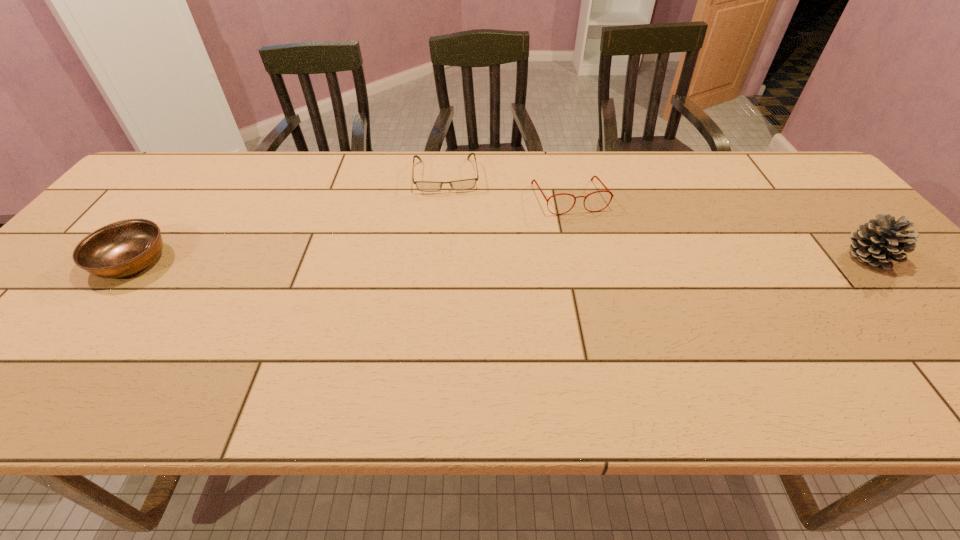
In the image, there is a desktop. Where is `free space at the left edge`? The image size is (960, 540). free space at the left edge is located at coordinates (60, 291).

In the image, there is a desktop. At what (x,y) coordinates should I click in order to perform the action: click on vacant region at the right edge. Please return your answer as a coordinate pair (x, y). This screenshot has width=960, height=540. Looking at the image, I should click on (814, 238).

In order to click on free point at the far right corner in this screenshot , I will do `click(801, 194)`.

In the image, there is a desktop. In order to click on vacant space at the near right corner in this screenshot , I will do `click(949, 355)`.

Where is `unoccupied area between the pinecone and the right spectacles`? The height and width of the screenshot is (540, 960). unoccupied area between the pinecone and the right spectacles is located at coordinates (719, 227).

At what (x,y) coordinates should I click in order to perform the action: click on unoccupied position between the taller spectacles and the third tallest object. Please return your answer as a coordinate pair (x, y). Looking at the image, I should click on (350, 230).

The height and width of the screenshot is (540, 960). I want to click on empty space that is in between the soup bowl and the pinecone, so click(x=500, y=259).

The image size is (960, 540). Identify the location of vacant point located between the right spectacles and the left spectacles. (508, 187).

I want to click on free space that is in between the second object from left to right and the taller spectacles, so click(508, 187).

Image resolution: width=960 pixels, height=540 pixels. What are the coordinates of `vacant space in between the soup bowl and the right spectacles` in the screenshot? It's located at (350, 230).